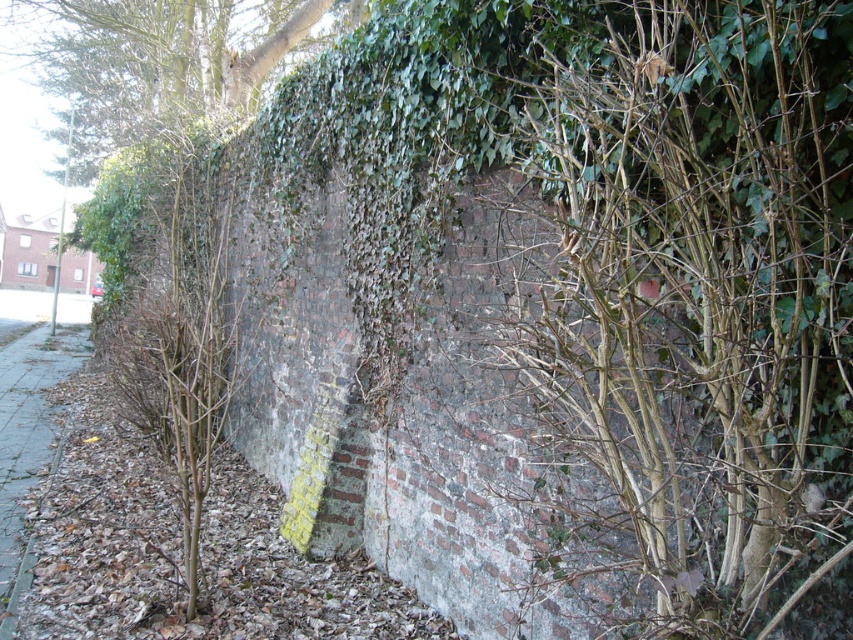
Who is shorter, bare branches at center or green leafy tree at upper left?

bare branches at center is shorter.

Is bare branches at center bigger than green leafy tree at upper left?

No, bare branches at center is not bigger than green leafy tree at upper left.

Is point (737, 460) behind point (213, 65)?

That is False.

You are a GUI agent. You are given a task and a screenshot of the screen. Output one action in this format:
    pyautogui.click(x=<x>, y=<y>)
    Task: Click on the bare branches at center
    The image size is (853, 640).
    Given the screenshot: What is the action you would take?
    pyautogui.click(x=698, y=292)

Does bare branches at center have a lesser height compared to gray concrete pavement at lower left?

In fact, bare branches at center may be taller than gray concrete pavement at lower left.

Is point (804, 161) positioned behind point (54, 369)?

That is False.

This screenshot has height=640, width=853. I want to click on bare branches at center, so click(x=698, y=292).

Who is more forward, (x=123, y=80) or (x=10, y=580)?

Point (x=10, y=580) is in front.

Between point (212, 112) and point (12, 515), which one is positioned behind?

Point (212, 112)

Where is `green leafy tree at upper left`? green leafy tree at upper left is located at coordinates (167, 58).